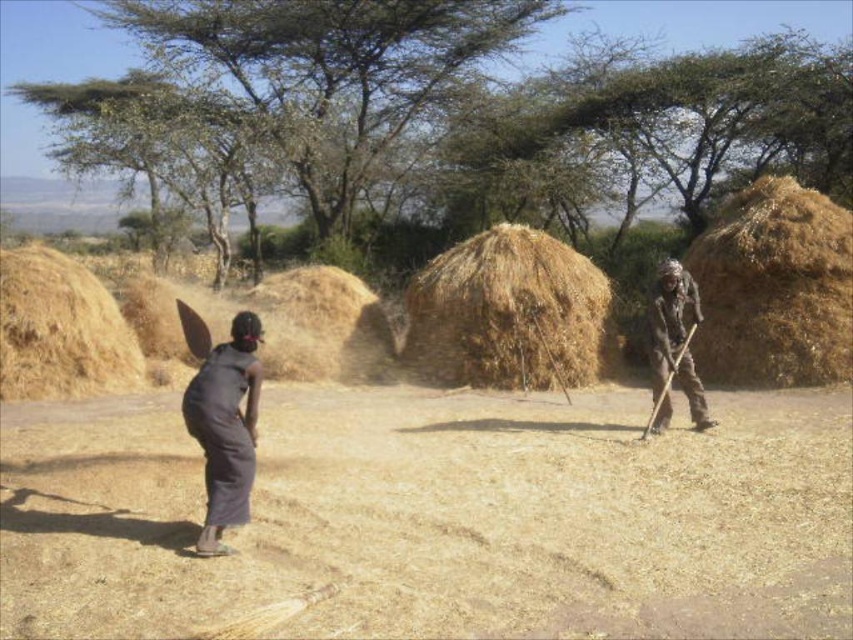
Which is in front, point (718, 369) or point (194, 420)?

Positioned in front is point (194, 420).

Does brown straw stack at right appear over dark gray fabric at lower left?

Correct, brown straw stack at right is located above dark gray fabric at lower left.

Identify the location of brown straw stack at right. (775, 288).

Does brown dry dirt at center have a lesser width compared to brown straw at center?

Incorrect, brown dry dirt at center's width is not less than brown straw at center's.

Between point (314, 481) and point (368, 346), which one is positioned behind?

Positioned behind is point (368, 346).

Locate an element on the screen. Image resolution: width=853 pixels, height=640 pixels. brown dry dirt at center is located at coordinates (438, 516).

Does brown straw stack at center appear over brown straw at center?

Yes, brown straw stack at center is above brown straw at center.

Between brown straw stack at center and brown straw at center, which one is positioned higher?

Positioned higher is brown straw stack at center.

Is point (401, 349) closer to camera compared to point (306, 371)?

No, it is not.

Locate an element on the screen. brown straw stack at center is located at coordinates (508, 312).